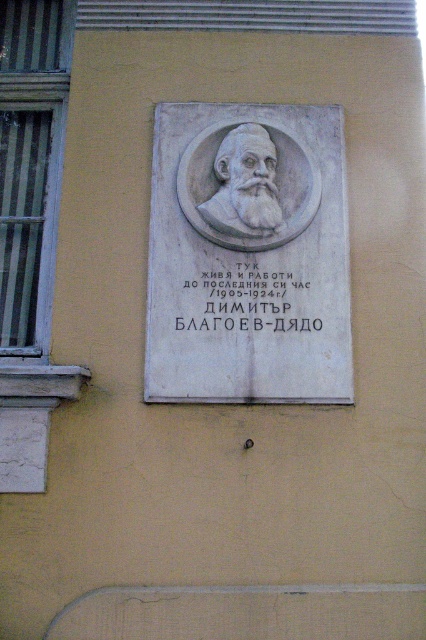
Which is below, white stone relief at center or white stone bust at center?

white stone relief at center

In the scene shown: Who is positioned more to the right, white stone relief at center or white stone bust at center?

white stone relief at center is more to the right.

Locate an element on the screen. This screenshot has height=640, width=426. white stone relief at center is located at coordinates (247, 256).

Consider the image. Is black stone plaque at center wider than white marble bust at center?

Correct, the width of black stone plaque at center exceeds that of white marble bust at center.

Between point (250, 282) and point (264, 141), which one is positioned in front?

Point (250, 282)

What do you see at coordinates (245, 300) in the screenshot? I see `black stone plaque at center` at bounding box center [245, 300].

Locate an element on the screen. black stone plaque at center is located at coordinates (245, 300).

Looking at this image, between white stone bust at center and black stone plaque at center, which one appears on the left side from the viewer's perspective?

white stone bust at center

Can you confirm if white stone bust at center is bigger than black stone plaque at center?

Yes, white stone bust at center is bigger than black stone plaque at center.

Locate an element on the screen. The height and width of the screenshot is (640, 426). white stone bust at center is located at coordinates (245, 186).